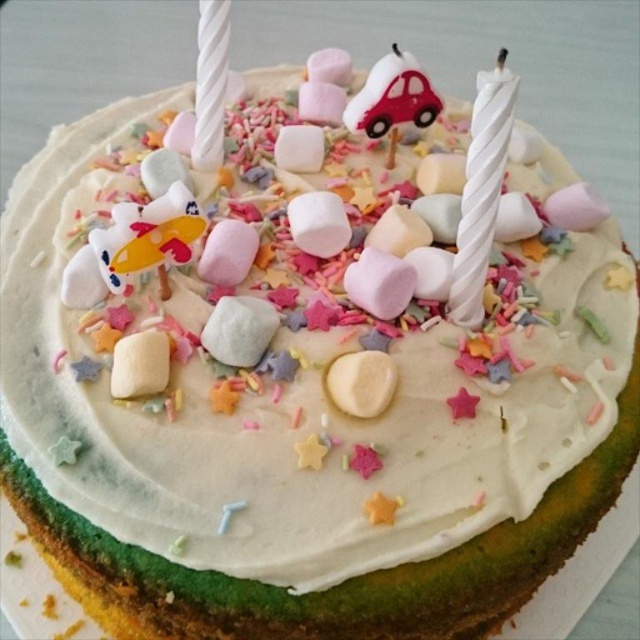
The width and height of the screenshot is (640, 640). Describe the element at coordinates (481, 189) in the screenshot. I see `white twisted candle at upper right` at that location.

Does white twisted candle at upper right have a greater width compared to white twisted candle at upper center?

In fact, white twisted candle at upper right might be narrower than white twisted candle at upper center.

In order to click on white twisted candle at upper right in this screenshot , I will do `click(481, 189)`.